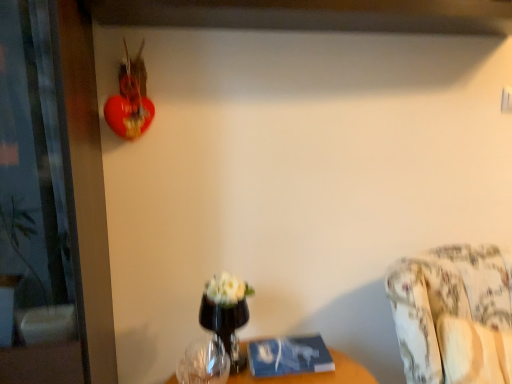
This screenshot has height=384, width=512. What do you see at coordinates (449, 309) in the screenshot? I see `floral fabric couch at lower right` at bounding box center [449, 309].

Locate an element on the screen. The image size is (512, 384). floral fabric couch at lower right is located at coordinates (449, 309).

The width and height of the screenshot is (512, 384). I want to click on transparent glass vase at center, so click(x=226, y=327).

Describe the element at coordinates (204, 362) in the screenshot. I see `transparent glass vase at lower center` at that location.

This screenshot has height=384, width=512. Find the location of `floral fabric couch at lower right`. floral fabric couch at lower right is located at coordinates (449, 309).

Where is `furniture located on the right of transparent glass vase at lower center`? The height and width of the screenshot is (384, 512). furniture located on the right of transparent glass vase at lower center is located at coordinates (449, 309).

Considering the relative sizes of transparent glass vase at lower center and floral fabric couch at lower right in the image provided, is transparent glass vase at lower center taller than floral fabric couch at lower right?

No.

Are transparent glass vase at lower center and floral fabric couch at lower right making contact?

No, transparent glass vase at lower center is not next to floral fabric couch at lower right.

Where is `glass vase below the transparent glass screen door at left (from the image's perspective)`? This screenshot has width=512, height=384. glass vase below the transparent glass screen door at left (from the image's perspective) is located at coordinates (226, 327).

Which is behind, point (243, 325) or point (63, 353)?

The point (243, 325) is more distant.

From a real-world perspective, which is physically above, transparent glass vase at center or transparent glass screen door at left?

transparent glass screen door at left.

Which object is thinner, transparent glass screen door at left or floral fabric couch at lower right?

With smaller width is transparent glass screen door at left.

Is the position of transparent glass screen door at left more distant than that of floral fabric couch at lower right?

No, the depth of transparent glass screen door at left is less than that of floral fabric couch at lower right.

Looking at this image, from a real-world perspective, is transparent glass screen door at left physically below floral fabric couch at lower right?

No, from a real-world perspective, transparent glass screen door at left is not under floral fabric couch at lower right.

Is transparent glass screen door at left smaller than floral fabric couch at lower right?

No.

Does transparent glass vase at lower center have a greater height compared to transparent glass screen door at left?

No, transparent glass vase at lower center is not taller than transparent glass screen door at left.

From a real-world perspective, which object rests below the other?

In real-world perspective, transparent glass vase at lower center is lower.

Which is more to the left, transparent glass vase at lower center or transparent glass screen door at left?

Positioned to the left is transparent glass screen door at left.

Who is bigger, transparent glass vase at lower center or transparent glass screen door at left?

transparent glass screen door at left is bigger.

Is point (207, 305) more distant than point (440, 312)?

No, it is in front of (440, 312).

From a real-world perspective, is transparent glass vase at center positioned above or below floral fabric couch at lower right?

transparent glass vase at center is above floral fabric couch at lower right.

Identify the location of furniture in front of the transparent glass vase at center. (449, 309).

Which is more to the right, transparent glass vase at center or floral fabric couch at lower right?

From the viewer's perspective, floral fabric couch at lower right appears more on the right side.

Is floral fabric couch at lower right turned away from transparent glass screen door at left?

No, floral fabric couch at lower right's orientation is not away from transparent glass screen door at left.

Identify the location of furniture that is below the transparent glass screen door at left (from the image's perspective). This screenshot has width=512, height=384. [449, 309].

Between floral fabric couch at lower right and transparent glass screen door at left, which one has less height?

Standing shorter between the two is floral fabric couch at lower right.

Which object is more forward, floral fabric couch at lower right or transparent glass screen door at left?

transparent glass screen door at left is more forward.

Between transparent glass screen door at left and transparent glass vase at lower center, which one has more height?

Standing taller between the two is transparent glass screen door at left.

What are the coordinates of `screen door above the transparent glass vase at lower center (from the image's perspective)` in the screenshot? It's located at (38, 190).

Looking at this image, does transparent glass screen door at left come in front of transparent glass vase at lower center?

Yes, it is.

From a real-world perspective, between transparent glass screen door at left and transparent glass vase at lower center, who is vertically lower?

transparent glass vase at lower center, from a real-world perspective.

Find the location of a particular element. This screenshot has height=384, width=512. furniture that appears in front of the transparent glass vase at lower center is located at coordinates (449, 309).

Where is `glass vase below the transparent glass screen door at left (from the image's perspective)`? This screenshot has height=384, width=512. glass vase below the transparent glass screen door at left (from the image's perspective) is located at coordinates (226, 327).

Looking at the image, which one is located further to transparent glass screen door at left, floral fabric couch at lower right or transparent glass vase at center?

floral fabric couch at lower right.

Which object lies nearer to the anchor point transparent glass vase at lower center, transparent glass vase at center or floral fabric couch at lower right?

The object closer to transparent glass vase at lower center is transparent glass vase at center.

In the scene shown: Which object lies nearer to the anchor point floral fabric couch at lower right, transparent glass vase at center or transparent glass screen door at left?

transparent glass vase at center is closer to floral fabric couch at lower right.

From the picture: Based on their spatial positions, is transparent glass screen door at left or floral fabric couch at lower right closer to transparent glass vase at center?

The object closer to transparent glass vase at center is transparent glass screen door at left.

Looking at this image, when comparing their distances from transparent glass screen door at left, does floral fabric couch at lower right or transparent glass vase at lower center seem closer?

The object closer to transparent glass screen door at left is transparent glass vase at lower center.

Estimate the real-world distances between objects in this image. Which object is further from floral fabric couch at lower right, transparent glass vase at center or transparent glass vase at lower center?

transparent glass vase at lower center is further to floral fabric couch at lower right.

Based on their spatial positions, is transparent glass vase at lower center or transparent glass screen door at left closer to transparent glass vase at center?

transparent glass vase at lower center is closer to transparent glass vase at center.

Which object lies further to the anchor point floral fabric couch at lower right, transparent glass vase at lower center or transparent glass screen door at left?

The object further to floral fabric couch at lower right is transparent glass screen door at left.

The width and height of the screenshot is (512, 384). What are the coordinates of `glass vase between transparent glass vase at lower center and floral fabric couch at lower right` in the screenshot? It's located at (226, 327).

I want to click on vase situated between transparent glass screen door at left and transparent glass vase at center from left to right, so click(204, 362).

The width and height of the screenshot is (512, 384). I want to click on glass vase located between transparent glass screen door at left and floral fabric couch at lower right in the left-right direction, so coord(226,327).

Find the location of `vase between transparent glass screen door at left and floral fabric couch at lower right in the horizontal direction`. vase between transparent glass screen door at left and floral fabric couch at lower right in the horizontal direction is located at coordinates (204, 362).